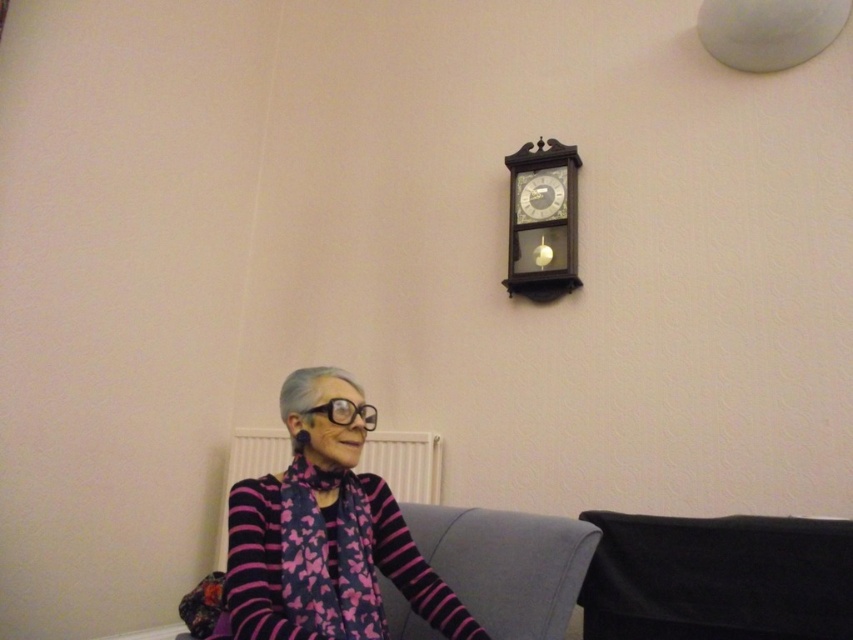
Question: In this image, where is black fabric at lower right located relative to white plastic radiator at lower center?

Choices:
 (A) right
 (B) left

Answer: (A)

Question: Estimate the real-world distances between objects in this image. Which object is closer to the white plastic radiator at lower center?

Choices:
 (A) wooden clock at upper center
 (B) pink striped sweater at lower left

Answer: (A)

Question: In this image, where is fabric couch at lower center located relative to wooden clock at upper center?

Choices:
 (A) right
 (B) left

Answer: (B)

Question: Which point is closer to the camera?

Choices:
 (A) (378, 564)
 (B) (561, 168)

Answer: (A)

Question: Does black fabric at lower right appear over white plastic radiator at lower center?

Choices:
 (A) yes
 (B) no

Answer: (A)

Question: Among these objects, which one is farthest from the camera?

Choices:
 (A) white plastic radiator at lower center
 (B) pink striped sweater at lower left
 (C) fabric couch at lower center
 (D) black fabric at lower right

Answer: (A)